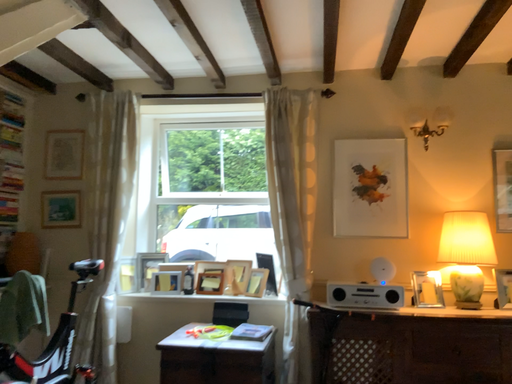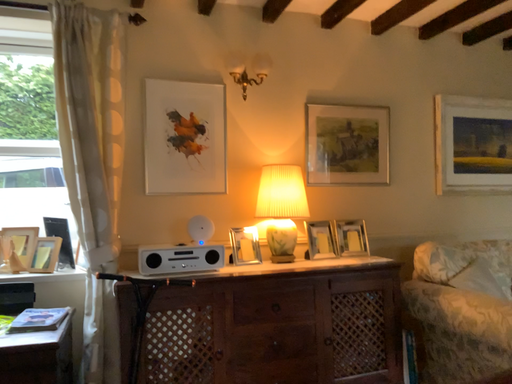
Question: How did the camera likely rotate when shooting the video?

Choices:
 (A) rotated left
 (B) rotated right

Answer: (B)